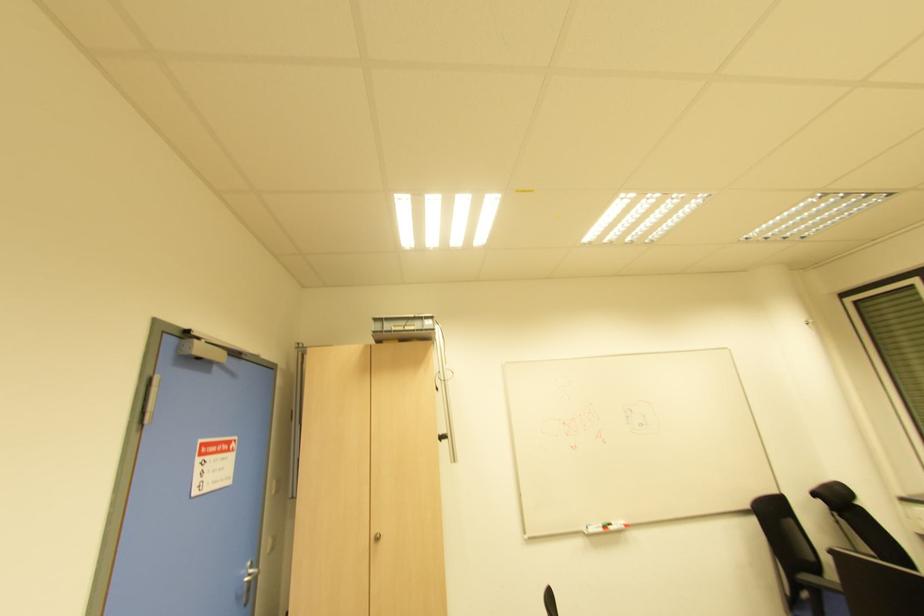
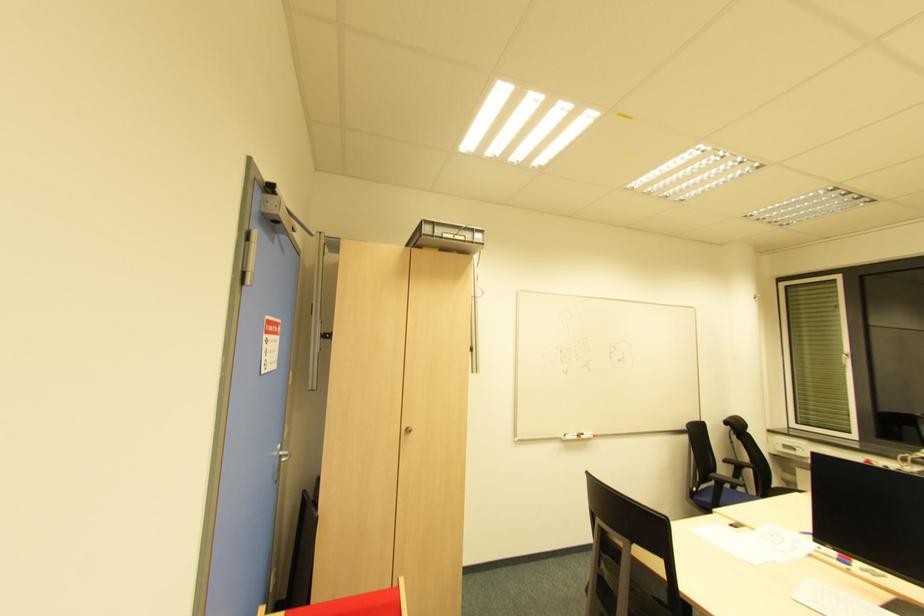
Question: The images are taken continuously from a first-person perspective. In which direction is your viewpoint rotating?

Choices:
 (A) Left
 (B) Right
 (C) Up
 (D) Down

Answer: (B)